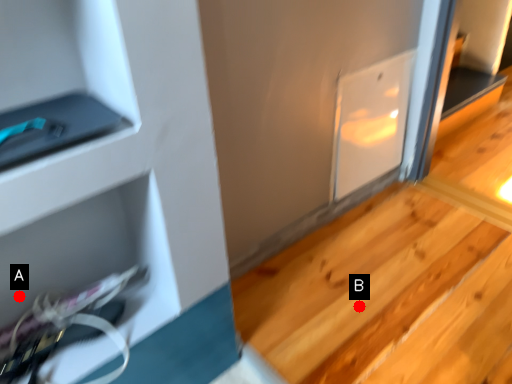
Question: Two points are circled on the image, labeled by A and B beside each circle. Which point is closer to the camera taking this photo?

Choices:
 (A) A is closer
 (B) B is closer

Answer: (A)